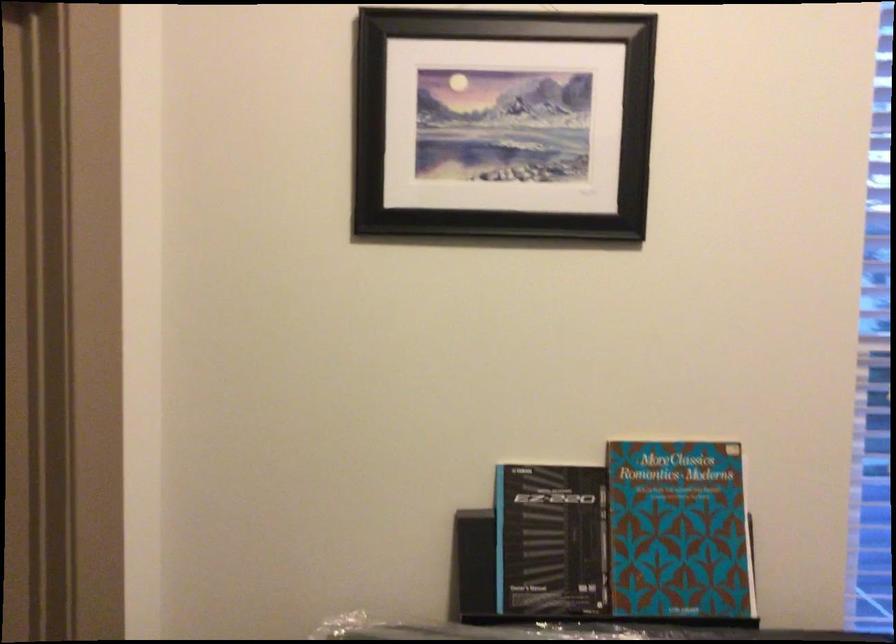
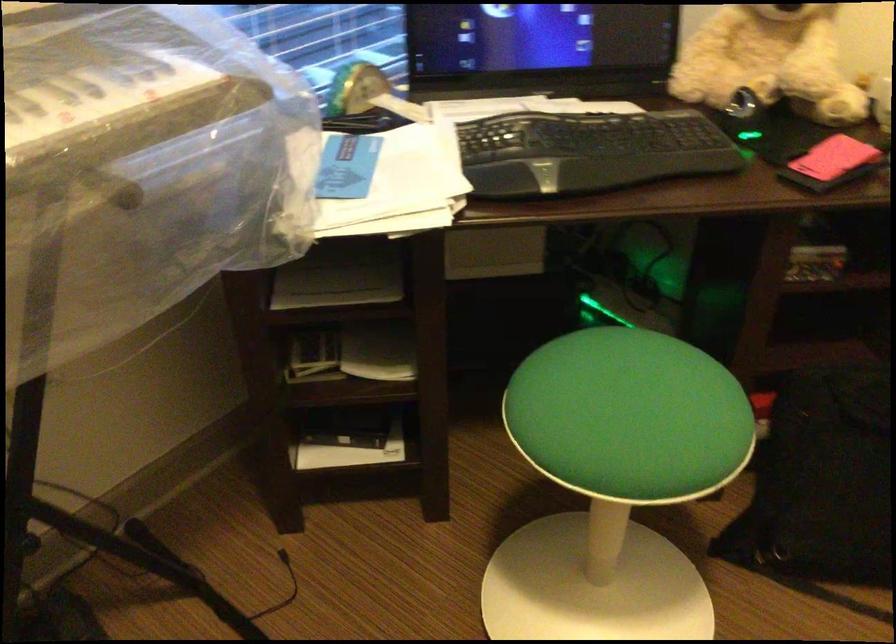
First-person continuous shooting, in which direction is the camera rotating?

The camera's rotation is toward right-down.